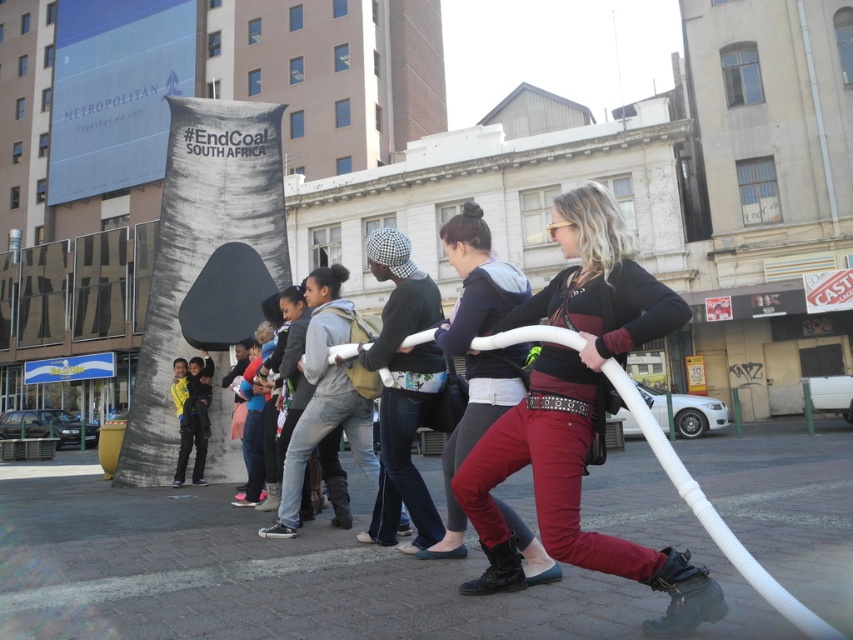
In the scene shown: Between brick pavement at lower center and black cotton shirt at center, which one has more height?

brick pavement at lower center

Is brick pavement at lower center to the right of black cotton shirt at center from the viewer's perspective?

Correct, you'll find brick pavement at lower center to the right of black cotton shirt at center.

The height and width of the screenshot is (640, 853). In order to click on brick pavement at lower center in this screenshot , I will do pyautogui.click(x=270, y=580).

Locate an element on the screen. The width and height of the screenshot is (853, 640). brick pavement at lower center is located at coordinates (270, 580).

Consider the image. Does brick pavement at lower center have a greater height compared to matte black pants at center?

Yes, brick pavement at lower center is taller than matte black pants at center.

Can you confirm if brick pavement at lower center is positioned to the right of matte black pants at center?

Indeed, brick pavement at lower center is positioned on the right side of matte black pants at center.

Between point (236, 609) and point (515, 300), which one is positioned in front?

Point (236, 609) is more forward.

At what (x,y) coordinates should I click in order to perform the action: click on brick pavement at lower center. Please return your answer as a coordinate pair (x, y). Image resolution: width=853 pixels, height=640 pixels. Looking at the image, I should click on (270, 580).

Which of these two, matte black pants at center or black cotton shirt at center, stands shorter?

matte black pants at center is shorter.

Who is lower down, matte black pants at center or black cotton shirt at center?

black cotton shirt at center is below.

Is point (482, 387) farther from viewer compared to point (416, 403)?

No, (482, 387) is in front of (416, 403).

Locate an element on the screen. matte black pants at center is located at coordinates (476, 353).